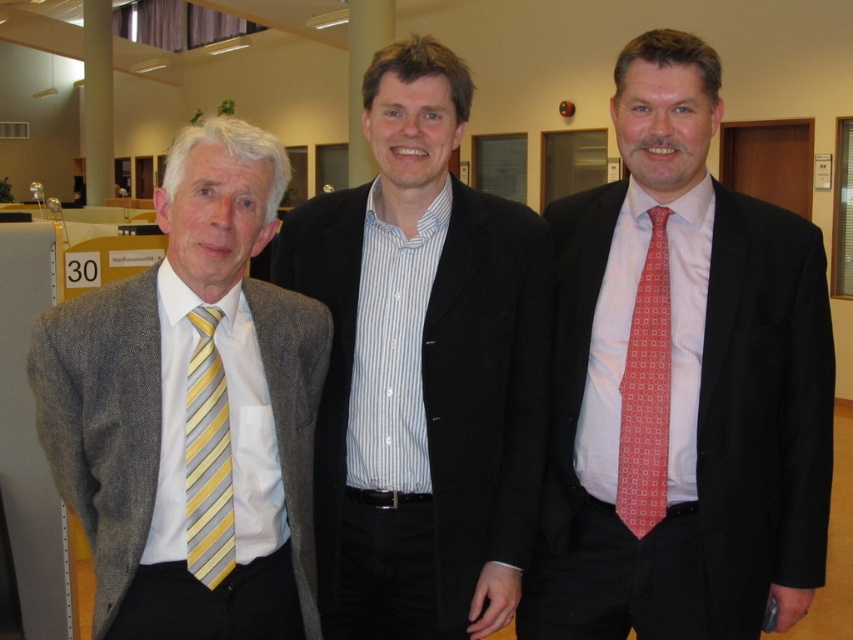
You are standing in an office and need to locate the matte black suit at center. According to the coordinates provided, where exactly would you find it?

The matte black suit at center is located at coordinates point (682, 385).

You are a fashion designer observing the three men in the office scene. You need to determine which item has a greater width between the white striped shirt at center and the red silk tie at right. Which one is wider?

The white striped shirt at center has a greater width than the red silk tie at right according to the description provided.